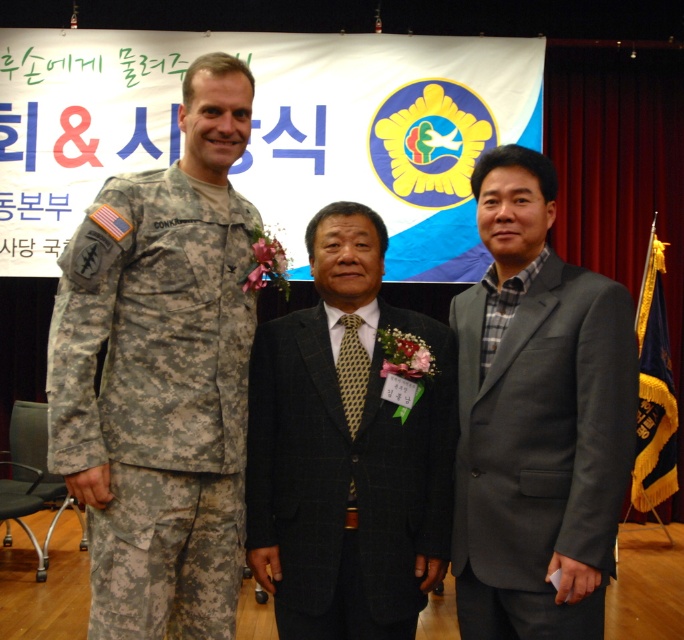
What are the coordinates of the camouflage uniform at left in the image?

The camouflage uniform at left is located at coordinates (161,376).

You are a photographer at a formal event. You need to position a 2.5 meter wide backdrop behind the gray wool suit at center and the blue velvet flag at right. Will the backdrop be wide enough to cover both objects?

The gray wool suit at center is 3.47 meters from the blue velvet flag at right. Since the backdrop is only 2.5 meters wide, it will not be wide enough to cover both objects as the distance between them exceeds the backdrop width.